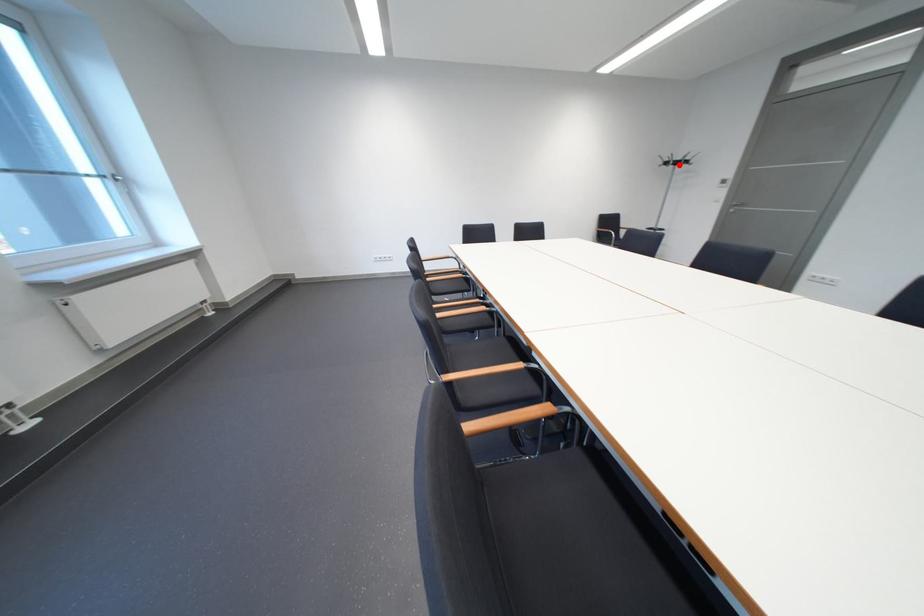
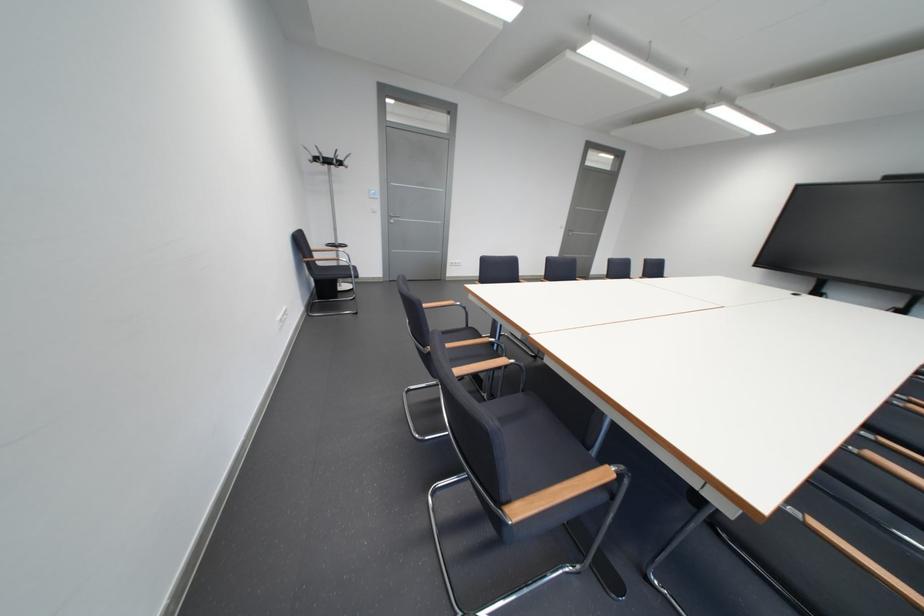
Question: A red point is marked in image1. In image2, is the corresponding 3D point closer to the camera or farther? Reply with the corresponding letter.

Choices:
 (A) The corresponding 3D point is closer.
 (B) The corresponding 3D point is farther.

Answer: (A)